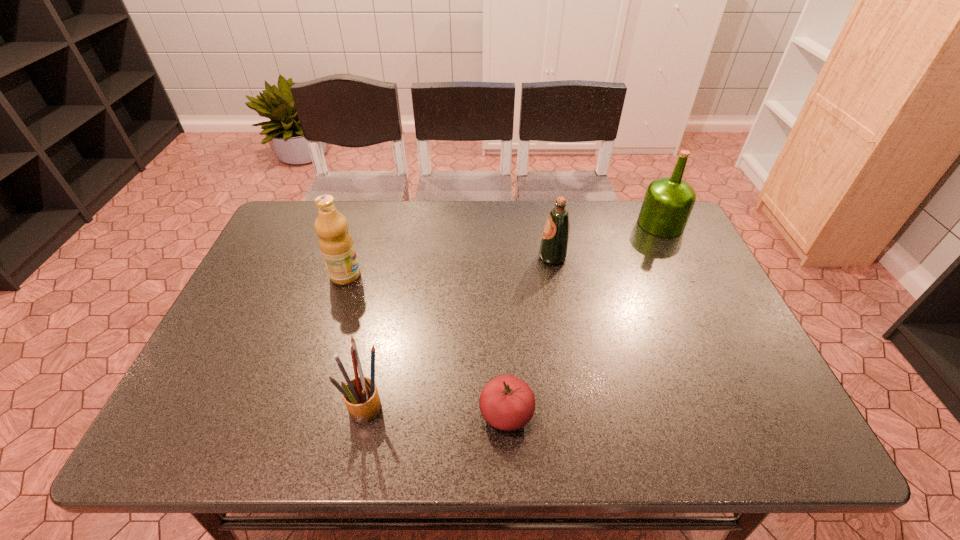
What are the coordinates of `the leftmost object` in the screenshot? It's located at (336, 244).

Locate an element on the screen. the rightmost object is located at coordinates (668, 201).

This screenshot has height=540, width=960. Identify the location of the farthest object. (668, 201).

Locate an element on the screen. Image resolution: width=960 pixels, height=540 pixels. the shortest olive oil is located at coordinates (554, 247).

This screenshot has width=960, height=540. Identify the location of the third tallest object. (554, 247).

The width and height of the screenshot is (960, 540). Identify the location of the fourth object from right to left. (361, 397).

You are a GUI agent. You are given a task and a screenshot of the screen. Output one action in this format:
    pyautogui.click(x=<x>, y=<y>)
    Task: Click on the pencil box
    The height and width of the screenshot is (540, 960).
    Given the screenshot: What is the action you would take?
    [x=361, y=397]

Where is `the third object from right to left`? This screenshot has width=960, height=540. the third object from right to left is located at coordinates (507, 403).

This screenshot has height=540, width=960. Find the location of `the shortest object`. the shortest object is located at coordinates (507, 403).

The width and height of the screenshot is (960, 540). In order to click on free space located on the label of the leftmost olive oil in this screenshot , I will do `click(445, 275)`.